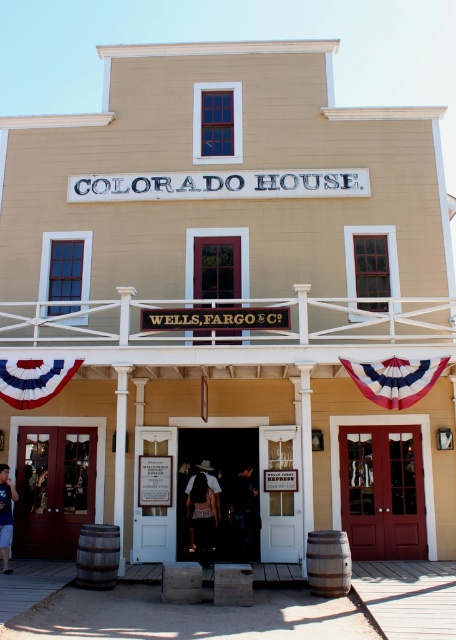
Question: Which object appears farthest from the camera in this image?

Choices:
 (A) white cotton shirt at center
 (B) dark fabric coat at center

Answer: (B)

Question: Considering the relative positions of red-white-blue fabric banner at center and bright red fabric banner at lower left in the image provided, where is red-white-blue fabric banner at center located with respect to bright red fabric banner at lower left?

Choices:
 (A) above
 (B) below

Answer: (B)

Question: Among these points, which one is farthest from the camera?

Choices:
 (A) (214, 483)
 (B) (19, 445)

Answer: (B)

Question: In this image, where is matte brown door at center located relative to denim shorts at lower center?

Choices:
 (A) right
 (B) left

Answer: (A)

Question: Among these objects, which one is farthest from the camera?

Choices:
 (A) wooden door at center
 (B) bright red fabric banner at lower left
 (C) denim shorts at lower center
 (D) red-white-blue fabric banner at center

Answer: (A)

Question: Does white cotton shirt at center come behind denim shorts at lower center?

Choices:
 (A) yes
 (B) no

Answer: (A)